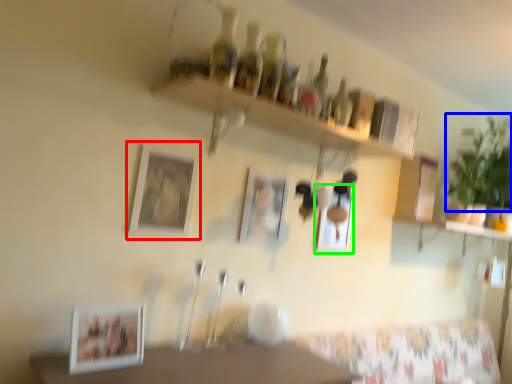
Question: Estimate the real-world distances between objects in this image. Which object is closer to picture frame (highlighted by a red box), plant (highlighted by a blue box) or picture frame (highlighted by a green box)?

Choices:
 (A) plant
 (B) picture frame

Answer: (B)